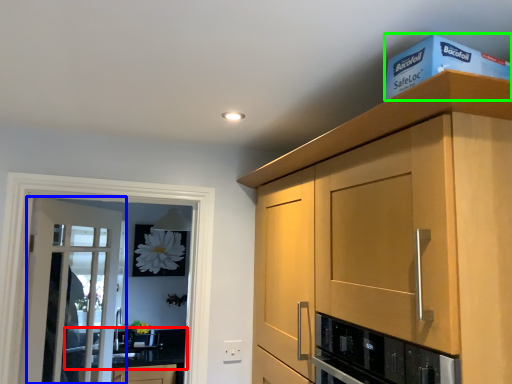
Question: Which is nearer to the countertop (highlighted by a red box)? door (highlighted by a blue box) or box (highlighted by a green box).

Choices:
 (A) door
 (B) box

Answer: (A)